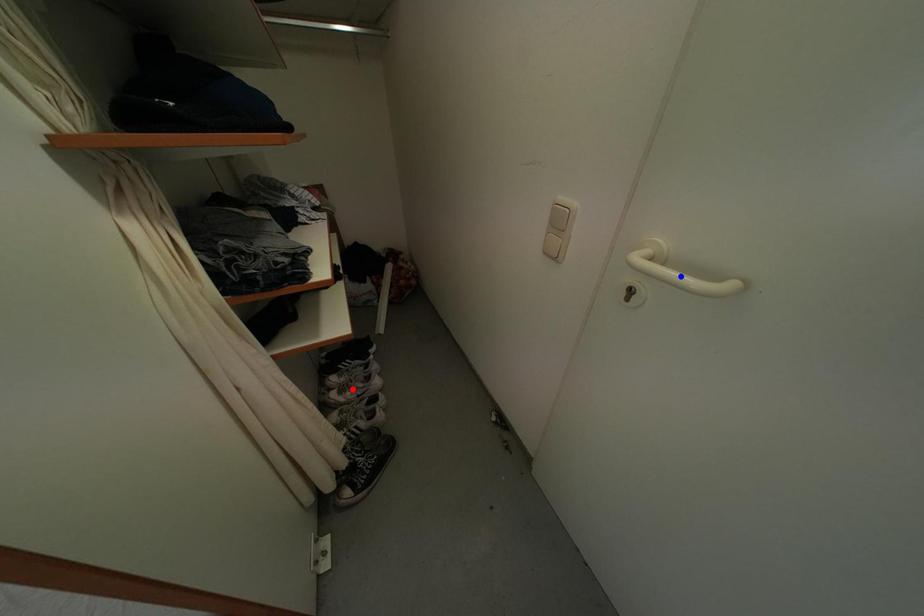
Question: In the image, two points are highlighted. Which point is nearer to the camera? Reply with the corresponding letter.

Choices:
 (A) blue point
 (B) red point

Answer: (A)